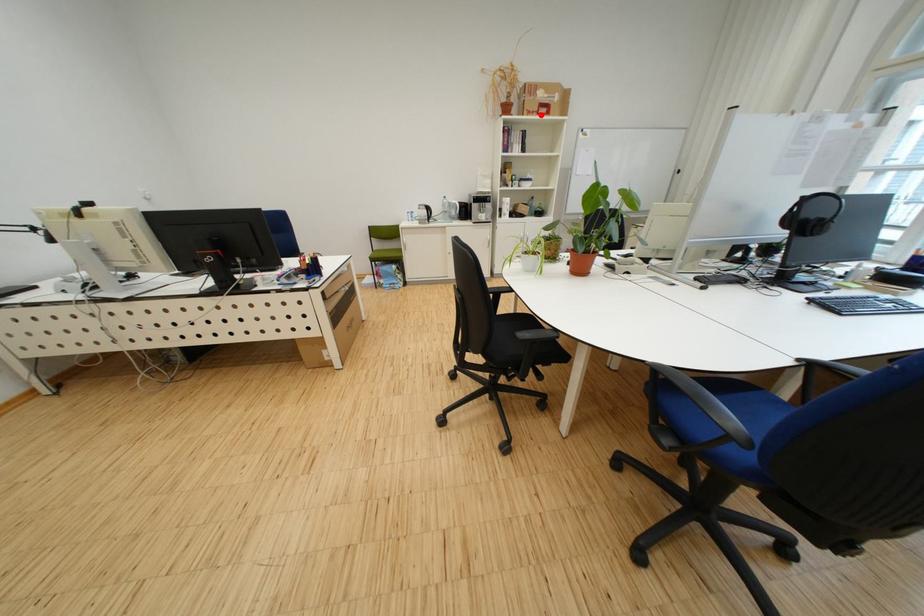
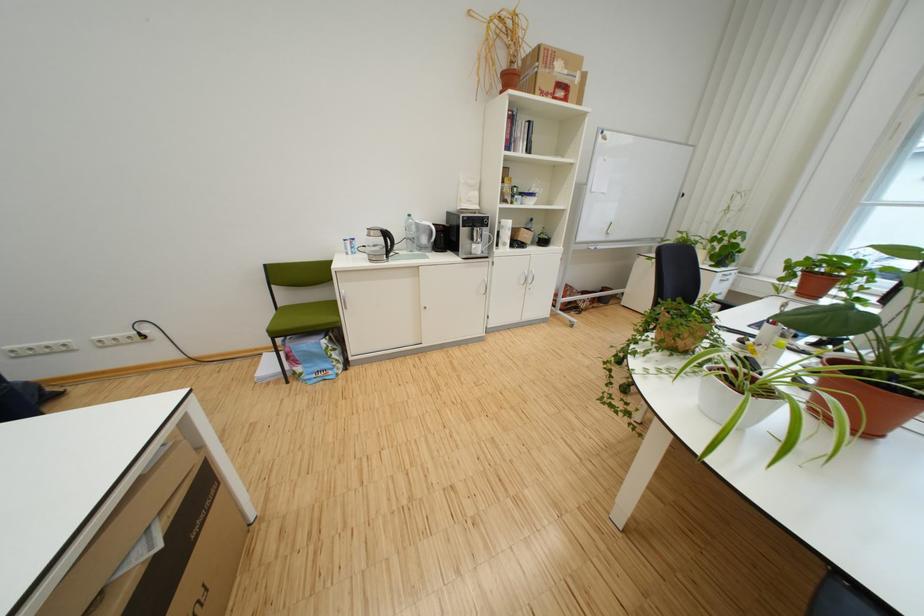
Find the pixel in the second image that matches the highlighted location in the first image.

(553, 95)